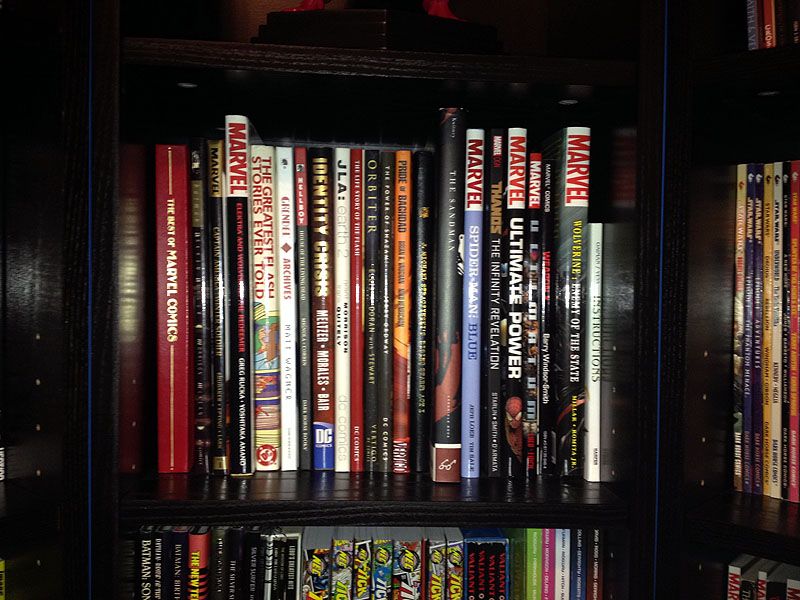
Locate an element on the screen. statue base is located at coordinates (380, 31).